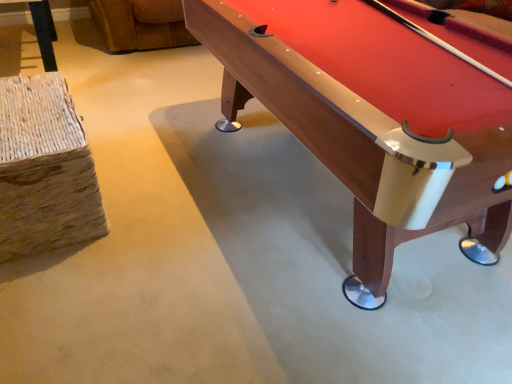
This screenshot has height=384, width=512. Identify the location of free space between wooden pool table at right and woven straw stool at left. (184, 231).